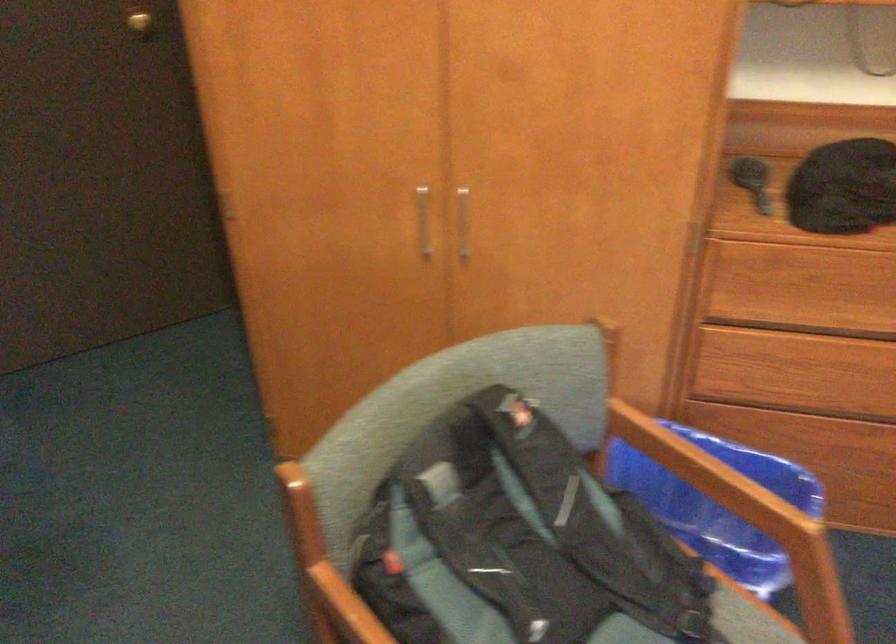
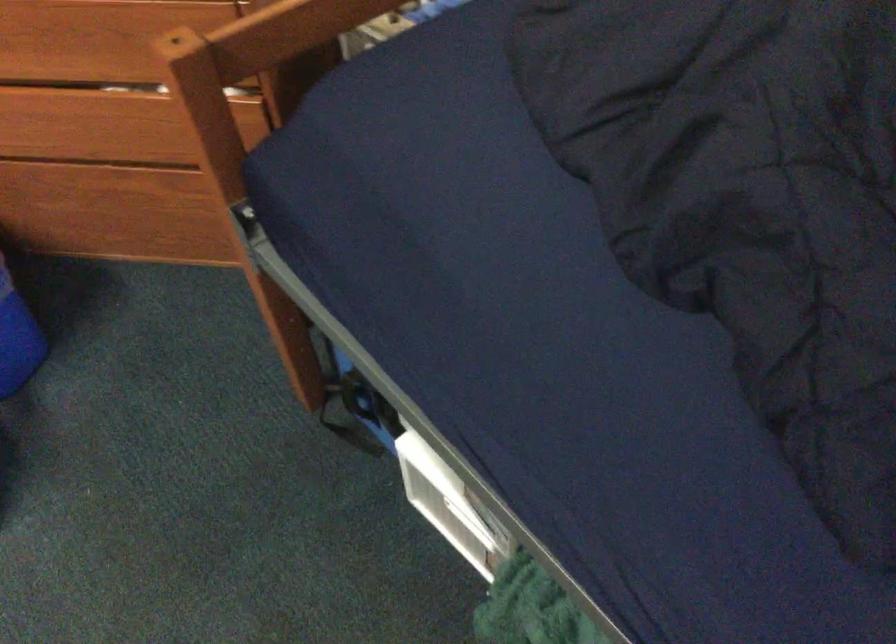
Question: In a continuous first-person perspective shot, in which direction is the camera moving?

Choices:
 (A) Left
 (B) Right
 (C) Forward
 (D) Backward

Answer: (B)